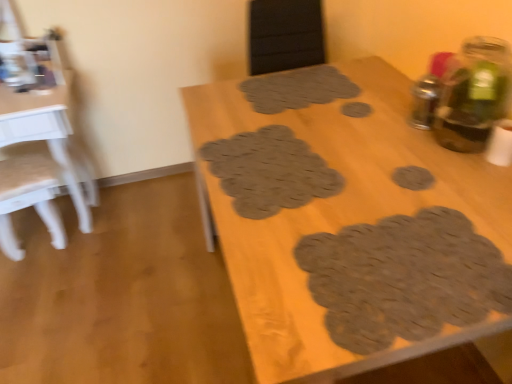
This screenshot has height=384, width=512. In order to click on free space between white glossy table at left, marked as the first table in a left-to-right arrangement, and brown textured placemats at center, which appears as the 2th table when viewed from the left in this screenshot , I will do `click(137, 285)`.